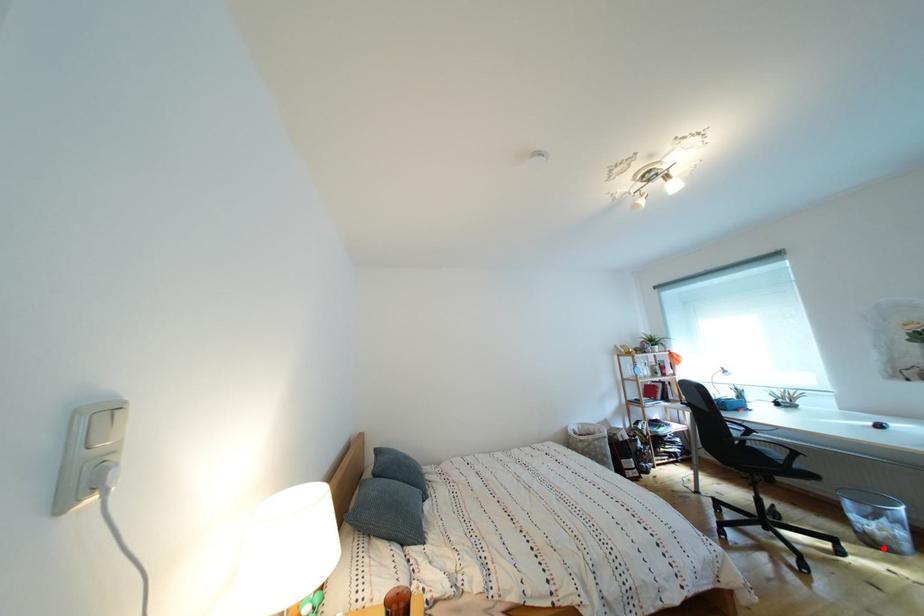
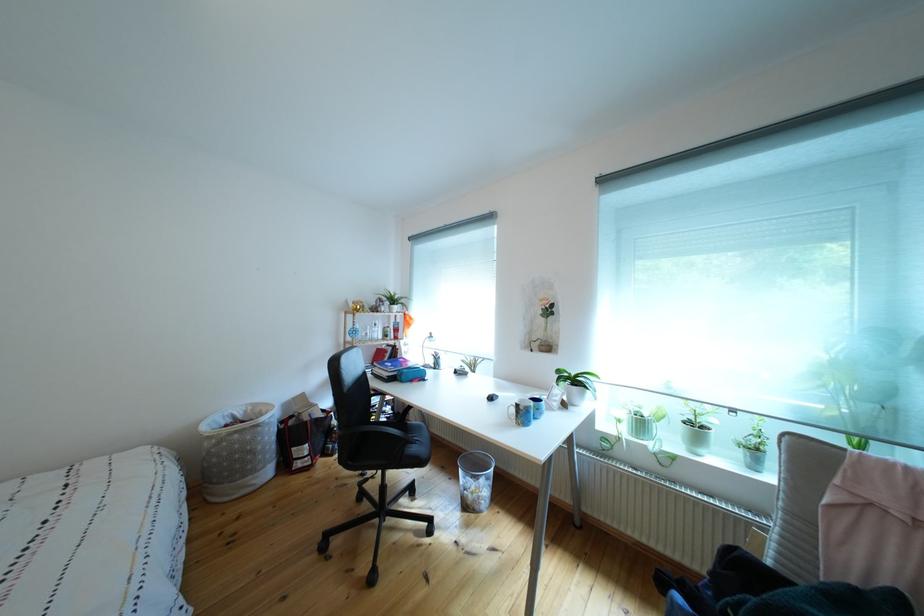
Find the pixel in the second image that matches the highlighted location in the first image.

(477, 512)